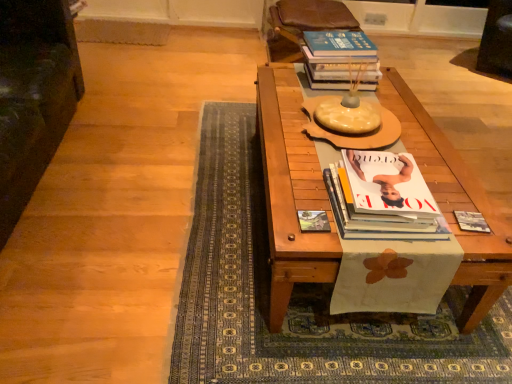
Identify the location of vacant space in between white glossy magazine at center, the third book from the back, and matte paper book cover at center. The height and width of the screenshot is (384, 512). (317, 205).